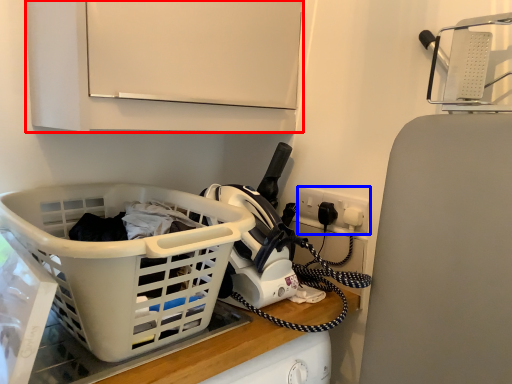
Question: Which object is further to the camera taking this photo, cabinetry (highlighted by a red box) or electric outlet (highlighted by a blue box)?

Choices:
 (A) cabinetry
 (B) electric outlet

Answer: (B)